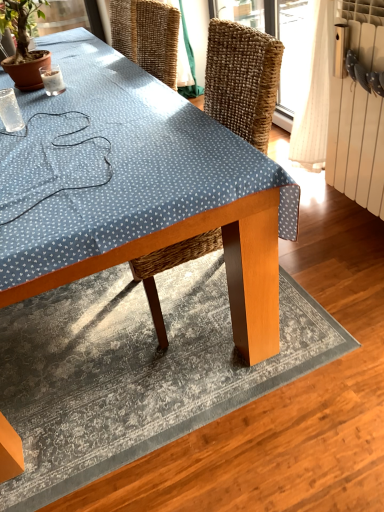
This screenshot has height=512, width=384. I want to click on free point behind transparent plastic cup at upper left, which appears as the 2th coffee cup when viewed from the back, so click(x=44, y=110).